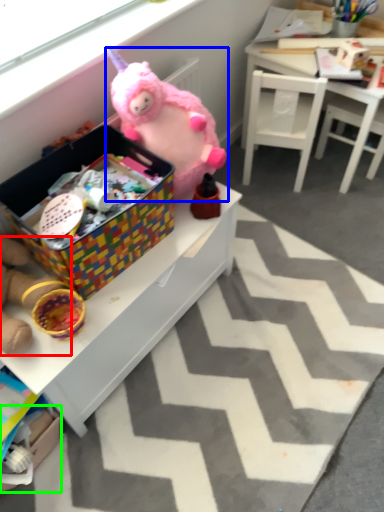
Question: Based on their relative distances, which object is nearer to toy (highlighted by a red box)? Choose from toy (highlighted by a blue box) and cardboard box (highlighted by a green box).

Choices:
 (A) toy
 (B) cardboard box

Answer: (B)